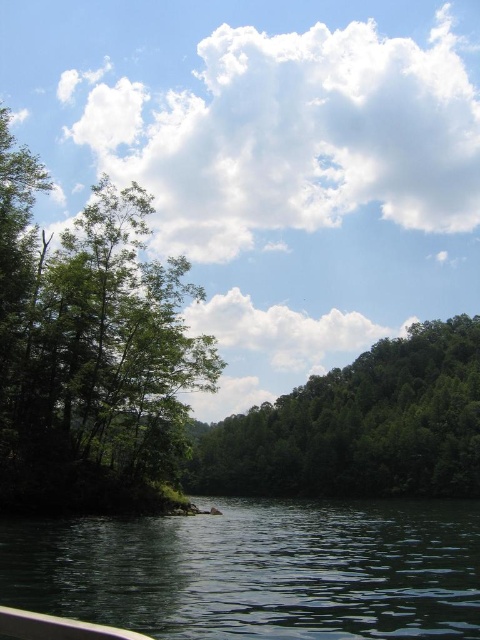
Question: Does dark green water at lower left come in front of green leafy tree at center?

Choices:
 (A) yes
 (B) no

Answer: (A)

Question: Which of the following is the farthest from the observer?

Choices:
 (A) green leafy tree at center
 (B) green leafy tree at left
 (C) dark green water at lower left

Answer: (A)

Question: In this image, where is green leafy tree at left located relative to green leafy tree at center?

Choices:
 (A) above
 (B) below

Answer: (A)

Question: Which point is closer to the camera?

Choices:
 (A) dark green water at lower left
 (B) green leafy tree at left

Answer: (A)

Question: Is dark green water at lower left thinner than green leafy tree at left?

Choices:
 (A) yes
 (B) no

Answer: (B)

Question: Which point is closer to the camera?

Choices:
 (A) green leafy tree at left
 (B) dark green water at lower left

Answer: (B)